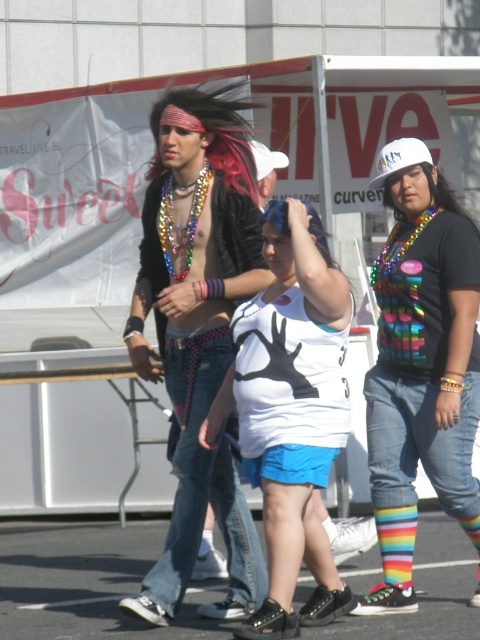
Question: Does rainbow striped socks at lower right appear over white matte baseball cap at upper center?

Choices:
 (A) yes
 (B) no

Answer: (B)

Question: Can you confirm if rainbow striped socks at center is bigger than rainbow striped socks at lower right?

Choices:
 (A) yes
 (B) no

Answer: (A)

Question: Which is nearer to the rainbow striped socks at lower right?

Choices:
 (A) white matte baseball cap at upper center
 (B) rainbow striped socks at center
 (C) shiny multicolored beads at center

Answer: (B)

Question: Which point appears farthest from the camera in this image?

Choices:
 (A) (392, 157)
 (B) (381, 547)
 (C) (394, 579)

Answer: (A)

Question: Is shiny multicolored beads at center below white matte baseball cap at upper center?

Choices:
 (A) no
 (B) yes

Answer: (B)

Question: Which point is closer to the camera?

Choices:
 (A) shiny multicolored beads at center
 (B) rainbow striped socks at lower right
 (C) white matte tank top at center

Answer: (C)